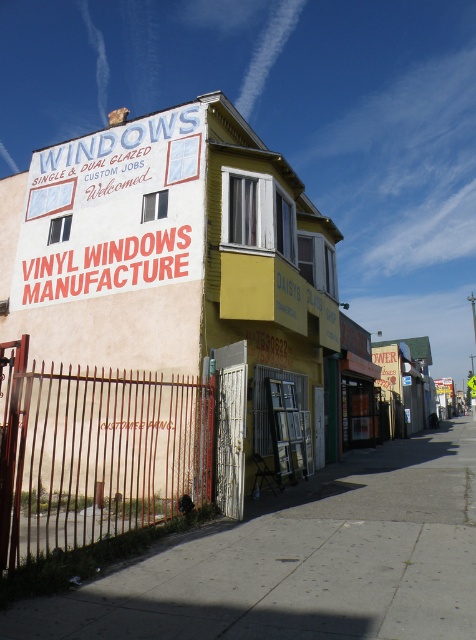
You are a delivery driver approaching the beige painted wall at center and the rusty metal gate at lower left. Which object is positioned higher relative to the other?

The beige painted wall at center is positioned higher than the rusty metal gate at lower left because it is described as being above it.

You are a delivery driver approaching the beige painted wall at center and the rusty metal gate at lower left. Which object is closer to the left side of the image?

The rusty metal gate at lower left is positioned on the left side of the beige painted wall at center, so it is closer to the left side of the image.